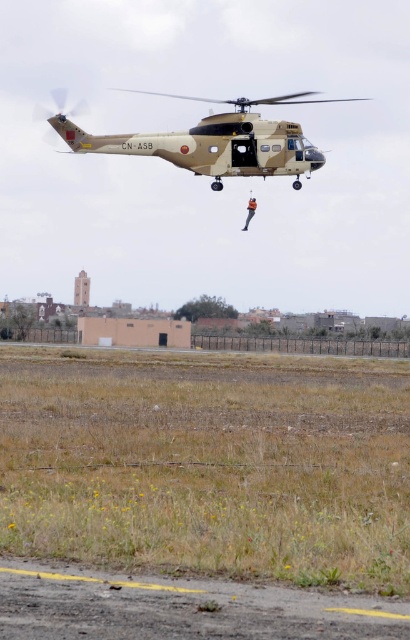
Between dark gray asphalt runway at lower center and camouflage fabric helicopter at center, which one has more height?

camouflage fabric helicopter at center is taller.

Is dark gray asphalt runway at lower center thinner than camouflage fabric helicopter at center?

Yes, dark gray asphalt runway at lower center is thinner than camouflage fabric helicopter at center.

I want to click on dark gray asphalt runway at lower center, so click(180, 608).